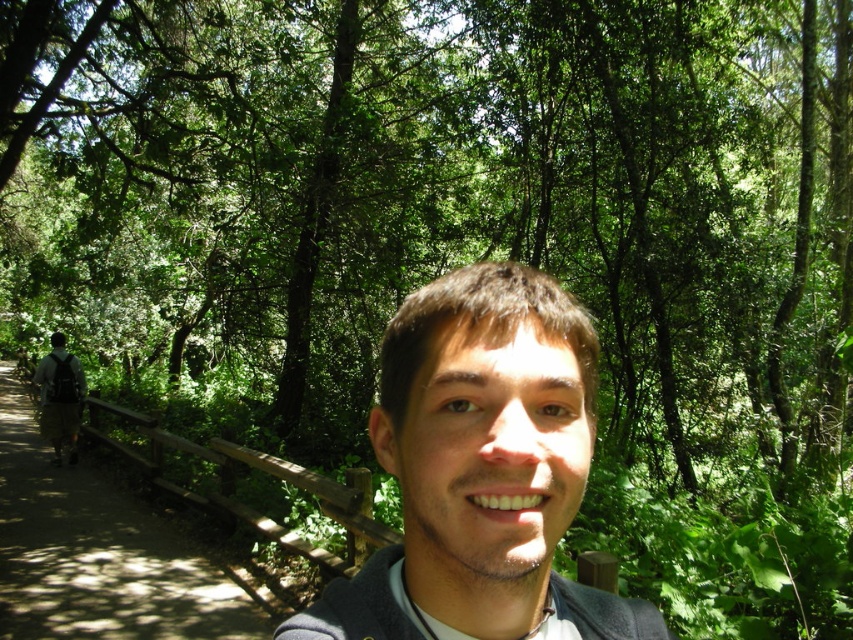
Question: Can you confirm if smooth skin face at center is thinner than brown wooden trail at left?

Choices:
 (A) no
 (B) yes

Answer: (B)

Question: Is brown hair at center above brown wooden trail at left?

Choices:
 (A) no
 (B) yes

Answer: (B)

Question: Which object appears farthest from the camera in this image?

Choices:
 (A) brown hair at center
 (B) brown wooden trail at left
 (C) smooth skin face at center
 (D) khaki pants at left

Answer: (D)

Question: Which object appears closest to the camera in this image?

Choices:
 (A) smooth skin face at center
 (B) brown hair at center
 (C) brown wooden trail at left
 (D) khaki pants at left

Answer: (A)

Question: Which point is closer to the camera?

Choices:
 (A) khaki pants at left
 (B) brown hair at center
 (C) smooth skin face at center

Answer: (C)

Question: Is brown wooden trail at left bigger than khaki pants at left?

Choices:
 (A) yes
 (B) no

Answer: (A)